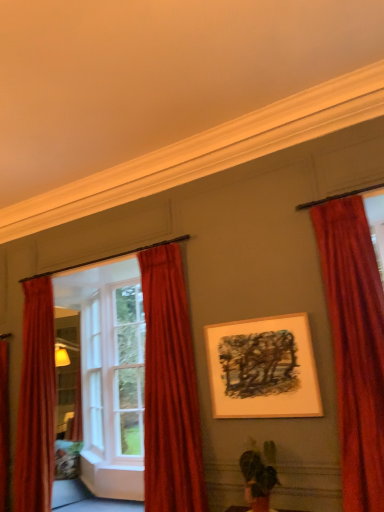
What do you see at coordinates (170, 389) in the screenshot?
I see `velvet red curtain at center, acting as the 2th curtain starting from the right` at bounding box center [170, 389].

Locate an element on the screen. wooden framed artwork at center is located at coordinates (263, 368).

What is the approximate width of green matte plant at lower center?

It is 11.96 inches.

Image resolution: width=384 pixels, height=512 pixels. Describe the element at coordinates (36, 401) in the screenshot. I see `velvet red curtain at left, the first curtain from the left` at that location.

I want to click on velvet red curtain at right, which is counted as the 1th curtain, starting from the right, so click(x=355, y=346).

I want to click on velvet red curtain at center, acting as the 2th curtain starting from the right, so click(170, 389).

Is the position of velvet red curtain at right, which is the 3th curtain in left-to-right order, more distant than that of velvet red curtain at center, acting as the 2th curtain starting from the right?

No, velvet red curtain at right, which is the 3th curtain in left-to-right order, is closer to the viewer.

Could you measure the distance between velvet red curtain at right, which is the 3th curtain in left-to-right order, and velvet red curtain at center, acting as the 2th curtain starting from the right?

velvet red curtain at right, which is the 3th curtain in left-to-right order, and velvet red curtain at center, acting as the 2th curtain starting from the right, are 1.32 meters apart from each other.

Locate an element on the screen. The width and height of the screenshot is (384, 512). curtain in front of the velvet red curtain at center, which is the 2th curtain in left-to-right order is located at coordinates (355, 346).

Considering the relative positions of velvet red curtain at right, which is counted as the 1th curtain, starting from the right, and velvet red curtain at center, which is the 2th curtain in left-to-right order, in the image provided, is velvet red curtain at right, which is counted as the 1th curtain, starting from the right, to the right of velvet red curtain at center, which is the 2th curtain in left-to-right order, from the viewer's perspective?

Yes.

Would you consider wooden framed artwork at center to be distant from velvet red curtain at left, the first curtain from the left?

Yes, wooden framed artwork at center and velvet red curtain at left, the first curtain from the left, are located far from each other.

Can you confirm if wooden framed artwork at center is shorter than velvet red curtain at left, the first curtain from the left?

Indeed, wooden framed artwork at center has a lesser height compared to velvet red curtain at left, the first curtain from the left.

Relative to velvet red curtain at left, the first curtain from the left, is wooden framed artwork at center in front or behind?

In the image, wooden framed artwork at center appears in front of velvet red curtain at left, the first curtain from the left.

From the image's perspective, which object appears higher, wooden framed artwork at center or velvet red curtain at left, the 3th curtain in the right-to-left sequence?

wooden framed artwork at center, from the image's perspective.

Is velvet red curtain at right, which is the 3th curtain in left-to-right order, facing away from white wood window frame at left?

No, velvet red curtain at right, which is the 3th curtain in left-to-right order, is not facing away from white wood window frame at left.

Does velvet red curtain at right, which is counted as the 1th curtain, starting from the right, have a greater height compared to white wood window frame at left?

In fact, velvet red curtain at right, which is counted as the 1th curtain, starting from the right, may be shorter than white wood window frame at left.

Between velvet red curtain at right, which is the 3th curtain in left-to-right order, and white wood window frame at left, which one has smaller width?

velvet red curtain at right, which is the 3th curtain in left-to-right order.

Which of these two, white wood window frame at left or velvet red curtain at right, which is counted as the 1th curtain, starting from the right, is smaller?

With smaller size is velvet red curtain at right, which is counted as the 1th curtain, starting from the right.

From the image's perspective, is white wood window frame at left beneath velvet red curtain at right, which is counted as the 1th curtain, starting from the right?

Indeed, from the image's perspective, white wood window frame at left is shown beneath velvet red curtain at right, which is counted as the 1th curtain, starting from the right.

Does white wood window frame at left turn towards velvet red curtain at right, which is the 3th curtain in left-to-right order?

No.

From a real-world perspective, is white wood window frame at left physically located above or below velvet red curtain at right, which is counted as the 1th curtain, starting from the right?

white wood window frame at left is situated lower than velvet red curtain at right, which is counted as the 1th curtain, starting from the right, in the real world.

Based on their positions, is white wood window frame at left located to the left or right of velvet red curtain at left, the 3th curtain in the right-to-left sequence?

white wood window frame at left is to the right of velvet red curtain at left, the 3th curtain in the right-to-left sequence.

Consider the image. From the image's perspective, is white wood window frame at left on top of velvet red curtain at left, the first curtain from the left?

Yes, from the image's perspective, white wood window frame at left is on top of velvet red curtain at left, the first curtain from the left.

Which is correct: white wood window frame at left is inside velvet red curtain at left, the first curtain from the left, or outside of it?

white wood window frame at left is outside velvet red curtain at left, the first curtain from the left.

From a real-world perspective, is white wood window frame at left located beneath velvet red curtain at left, the 3th curtain in the right-to-left sequence?

Incorrect, from a real-world perspective, white wood window frame at left is higher than velvet red curtain at left, the 3th curtain in the right-to-left sequence.

Is velvet red curtain at center, acting as the 2th curtain starting from the right, oriented towards wooden framed artwork at center?

No, velvet red curtain at center, acting as the 2th curtain starting from the right, is not aimed at wooden framed artwork at center.

Between velvet red curtain at center, acting as the 2th curtain starting from the right, and wooden framed artwork at center, which one has less height?

Standing shorter between the two is wooden framed artwork at center.

Would you say velvet red curtain at center, which is the 2th curtain in left-to-right order, is inside or outside wooden framed artwork at center?

velvet red curtain at center, which is the 2th curtain in left-to-right order, is spatially situated outside wooden framed artwork at center.

Is velvet red curtain at center, which is the 2th curtain in left-to-right order, next to wooden framed artwork at center?

No, velvet red curtain at center, which is the 2th curtain in left-to-right order, is not beside wooden framed artwork at center.

The image size is (384, 512). Find the location of `plant below the wooden framed artwork at center (from the image's perspective)`. plant below the wooden framed artwork at center (from the image's perspective) is located at coordinates (259, 475).

Is wooden framed artwork at center inside green matte plant at lower center?

No, wooden framed artwork at center is not a part of green matte plant at lower center.

From a real-world perspective, which is physically below, green matte plant at lower center or wooden framed artwork at center?

green matte plant at lower center is physically lower.

The image size is (384, 512). Find the location of `curtain that is the 1st object located below the velvet red curtain at right, which is the 3th curtain in left-to-right order (from the image's perspective)`. curtain that is the 1st object located below the velvet red curtain at right, which is the 3th curtain in left-to-right order (from the image's perspective) is located at coordinates (170, 389).

What are the coordinates of `the 2nd curtain behind when counting from the wooden framed artwork at center` in the screenshot? It's located at (36, 401).

Based on their spatial positions, is green matte plant at lower center or velvet red curtain at left, the first curtain from the left, closer to velvet red curtain at right, which is counted as the 1th curtain, starting from the right?

Based on the image, green matte plant at lower center appears to be nearer to velvet red curtain at right, which is counted as the 1th curtain, starting from the right.

Based on their spatial positions, is wooden framed artwork at center or velvet red curtain at right, which is counted as the 1th curtain, starting from the right, further from green matte plant at lower center?

Among the two, velvet red curtain at right, which is counted as the 1th curtain, starting from the right, is located further to green matte plant at lower center.

Estimate the real-world distances between objects in this image. Which object is closer to velvet red curtain at left, the first curtain from the left, white wood window frame at left or velvet red curtain at right, which is the 3th curtain in left-to-right order?

white wood window frame at left is closer to velvet red curtain at left, the first curtain from the left.

Based on their spatial positions, is green matte plant at lower center or white wood window frame at left closer to velvet red curtain at center, which is the 2th curtain in left-to-right order?

Based on the image, white wood window frame at left appears to be nearer to velvet red curtain at center, which is the 2th curtain in left-to-right order.

Considering their positions, is velvet red curtain at center, acting as the 2th curtain starting from the right, positioned further to wooden framed artwork at center than velvet red curtain at left, the first curtain from the left?

velvet red curtain at left, the first curtain from the left, is positioned further to the anchor wooden framed artwork at center.

From the image, which object appears to be farther from white wood window frame at left, green matte plant at lower center or velvet red curtain at left, the first curtain from the left?

Among the two, velvet red curtain at left, the first curtain from the left, is located further to white wood window frame at left.

Looking at the image, which one is located further to velvet red curtain at left, the 3th curtain in the right-to-left sequence, velvet red curtain at center, acting as the 2th curtain starting from the right, or green matte plant at lower center?

green matte plant at lower center is further to velvet red curtain at left, the 3th curtain in the right-to-left sequence.

Considering their positions, is velvet red curtain at right, which is counted as the 1th curtain, starting from the right, positioned further to velvet red curtain at center, which is the 2th curtain in left-to-right order, than green matte plant at lower center?

Based on the image, velvet red curtain at right, which is counted as the 1th curtain, starting from the right, appears to be further to velvet red curtain at center, which is the 2th curtain in left-to-right order.

You are a GUI agent. You are given a task and a screenshot of the screen. Output one action in this format:
    pyautogui.click(x=<x>, y=<y>)
    Task: Click on the picture frame between velvet red curtain at center, which is the 2th curtain in left-to-right order, and velvet red curtain at right, which is counted as the 1th curtain, starting from the right, in the horizontal direction
    The image size is (384, 512).
    Given the screenshot: What is the action you would take?
    pyautogui.click(x=263, y=368)

This screenshot has width=384, height=512. Identify the location of picture frame between velvet red curtain at right, which is the 3th curtain in left-to-right order, and green matte plant at lower center from top to bottom. (263, 368).

This screenshot has width=384, height=512. I want to click on curtain between velvet red curtain at left, the 3th curtain in the right-to-left sequence, and wooden framed artwork at center, so click(170, 389).

Image resolution: width=384 pixels, height=512 pixels. I want to click on plant between velvet red curtain at left, the first curtain from the left, and wooden framed artwork at center from left to right, so click(259, 475).